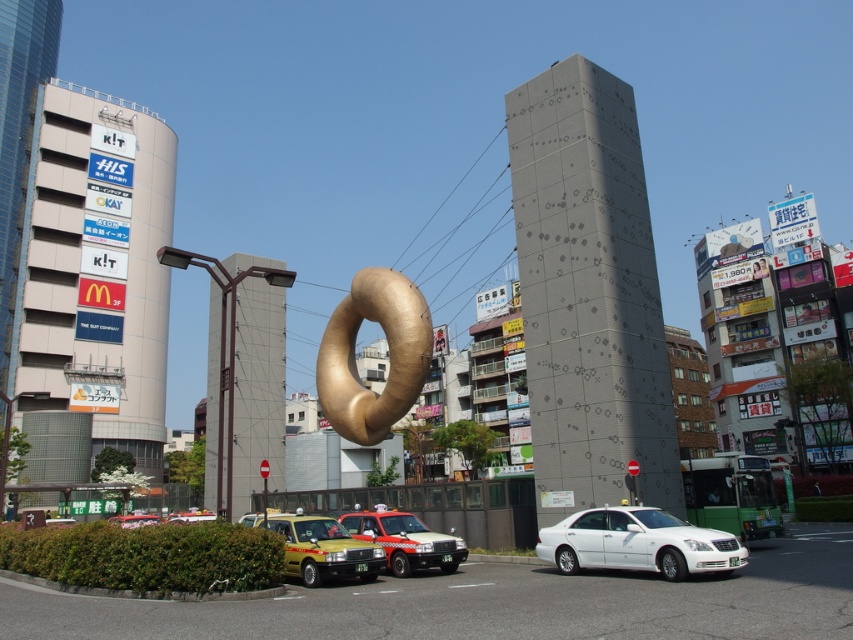
Can you confirm if white glossy sedan at center is bigger than metallic yellow taxi at lower left?

No, white glossy sedan at center is not bigger than metallic yellow taxi at lower left.

Can you confirm if white glossy sedan at center is positioned above metallic yellow taxi at lower left?

Yes.

The height and width of the screenshot is (640, 853). Describe the element at coordinates (637, 544) in the screenshot. I see `white glossy sedan at center` at that location.

Where is `white glossy sedan at center`? white glossy sedan at center is located at coordinates (637, 544).

Which is more to the left, gold metallic donut at center or yellow matte taxi at lower left?

yellow matte taxi at lower left is more to the left.

Which is behind, point (335, 353) or point (328, 572)?

The point (335, 353) is more distant.

Who is more forward, (418, 294) or (340, 572)?

Point (340, 572) is in front.

This screenshot has height=640, width=853. Find the location of `gold metallic donut at center`. gold metallic donut at center is located at coordinates (387, 355).

Between white glossy sedan at center and yellow matte taxi at lower left, which one is positioned lower?

yellow matte taxi at lower left

Is white glossy sedan at center thinner than yellow matte taxi at lower left?

Indeed, white glossy sedan at center has a lesser width compared to yellow matte taxi at lower left.

Is point (582, 554) behind point (317, 531)?

No.

This screenshot has width=853, height=640. Identify the location of white glossy sedan at center. (637, 544).